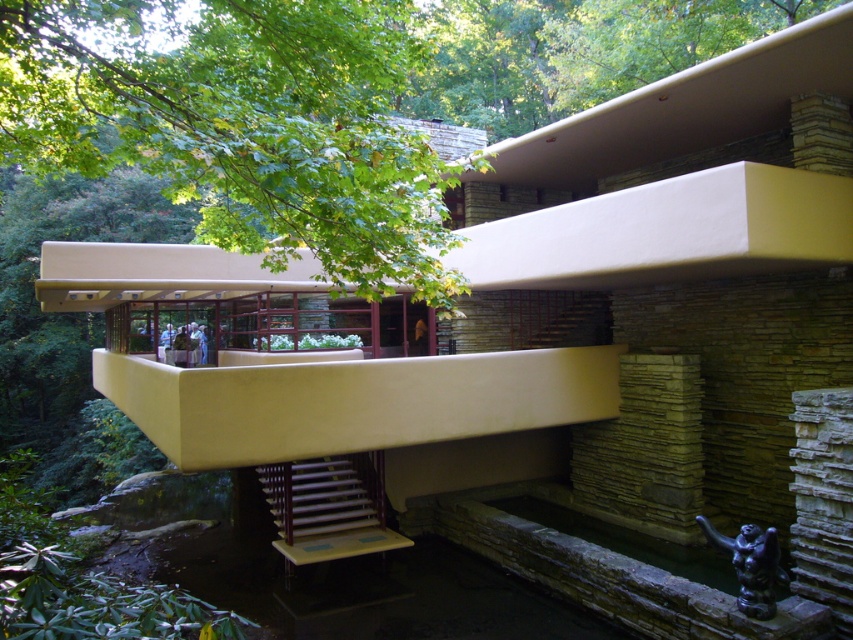
Does green leafy tree at upper left have a larger size compared to wooden stairs at center?

Yes, green leafy tree at upper left is bigger than wooden stairs at center.

Which is more to the right, green leafy tree at upper left or wooden stairs at center?

green leafy tree at upper left is more to the right.

At what (x,y) coordinates should I click in order to perform the action: click on green leafy tree at upper left. Please return your answer as a coordinate pair (x, y). The width and height of the screenshot is (853, 640). Looking at the image, I should click on (242, 124).